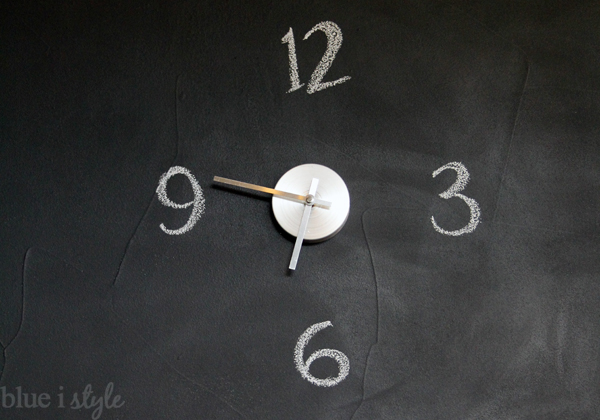
Identify the location of black/chalkboard surface. (160, 321).